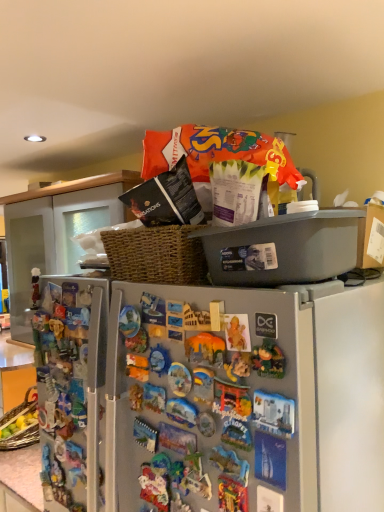
Question: Is matte plastic figurine at left, arranged as the 2th toy when viewed from the right, positioned in front of metallic gray refrigerator at center?

Choices:
 (A) yes
 (B) no

Answer: (A)

Question: Is matte plastic figurine at left, the 1th toy when ordered from left to right, thinner than metallic gray refrigerator at center?

Choices:
 (A) yes
 (B) no

Answer: (A)

Question: Considering the relative positions of matte plastic figurine at left, arranged as the 2th toy when viewed from the right, and metallic gray refrigerator at center in the image provided, is matte plastic figurine at left, arranged as the 2th toy when viewed from the right, behind metallic gray refrigerator at center?

Choices:
 (A) yes
 (B) no

Answer: (B)

Question: Is matte plastic figurine at left, the 1th toy when ordered from left to right, to the left of metallic gray refrigerator at center from the viewer's perspective?

Choices:
 (A) yes
 (B) no

Answer: (A)

Question: Does matte plastic figurine at left, which is the 2th toy in front-to-back order, turn towards metallic gray refrigerator at center?

Choices:
 (A) no
 (B) yes

Answer: (A)

Question: From a real-world perspective, is matte plastic figurine at left, which is the 2th toy in front-to-back order, over metallic gray refrigerator at center?

Choices:
 (A) no
 (B) yes

Answer: (B)

Question: Does metallic gray refrigerator at center appear on the left side of matte orange toy at center, the 2th toy positioned from the left?

Choices:
 (A) no
 (B) yes

Answer: (B)

Question: Is metallic gray refrigerator at center looking in the opposite direction of matte orange toy at center, positioned as the 1th toy in right-to-left order?

Choices:
 (A) no
 (B) yes

Answer: (A)

Question: Are metallic gray refrigerator at center and matte orange toy at center, which is the 2th toy in back-to-front order, far apart?

Choices:
 (A) no
 (B) yes

Answer: (A)

Question: From a real-world perspective, is metallic gray refrigerator at center beneath matte orange toy at center, the 2th toy positioned from the left?

Choices:
 (A) no
 (B) yes

Answer: (B)

Question: Does metallic gray refrigerator at center have a lesser width compared to matte orange toy at center, the 2th toy positioned from the left?

Choices:
 (A) no
 (B) yes

Answer: (A)

Question: Is metallic gray refrigerator at center in front of matte orange toy at center, which is counted as the 1th toy, starting from the front?

Choices:
 (A) yes
 (B) no

Answer: (B)

Question: Is metallic gray refrigerator at center closer to camera compared to matte plastic figurine at left, the 1th toy when ordered from left to right?

Choices:
 (A) yes
 (B) no

Answer: (B)